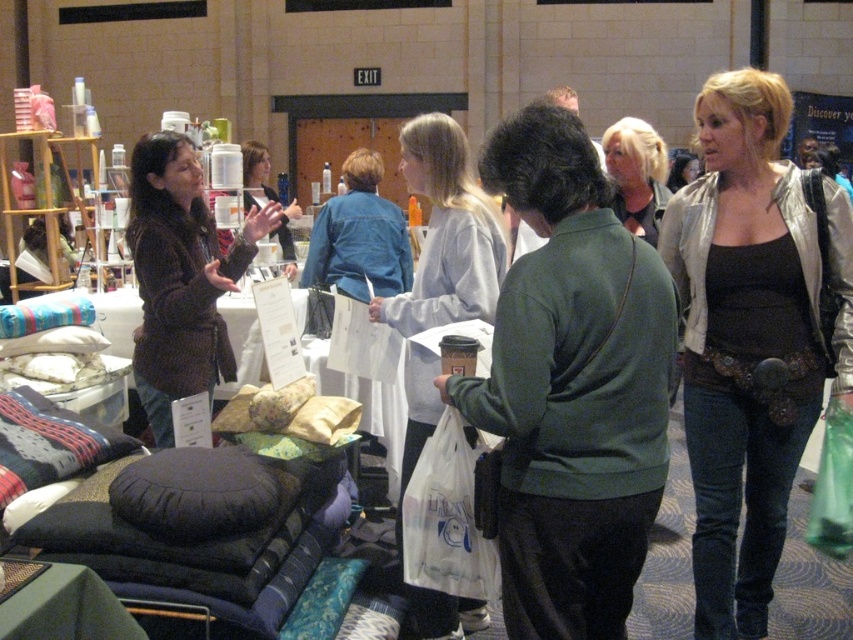
You are a photographer at the event and want to capture a photo that includes both the brown fuzzy sweater at upper left and the blonde hair at center. Which object should be placed more to the left in the frame to ensure both are visible?

The brown fuzzy sweater at upper left should be placed more to the left in the frame because it is already positioned on the left side of the blonde hair at center, so positioning it further left ensures both are visible without overlapping.

You are a photographer standing at the entrance of the market. You want to take a photo of the brown fuzzy sweater at upper left and the blonde hair at center so that both are in focus. The camera you are using has a depth of field that can cover objects within a 5 feet range. Will both subjects be in focus?

The brown fuzzy sweater at upper left is 5.09 feet away from blonde hair at center. Since the distance between them is slightly over 5 feet, the camera might not capture both in focus simultaneously.

You are standing in the market scene and want to locate the silver metallic jacket at center. Which object from the following list is closest to the point marked at coordinates (752, 337)? The options are the teal glossy water at lower center, the green bamboo dock at lower right, or the silver metallic jacket at center.

The point at coordinates (752, 337) is on the silver metallic jacket at center, so the closest object to that point is the silver metallic jacket at center.